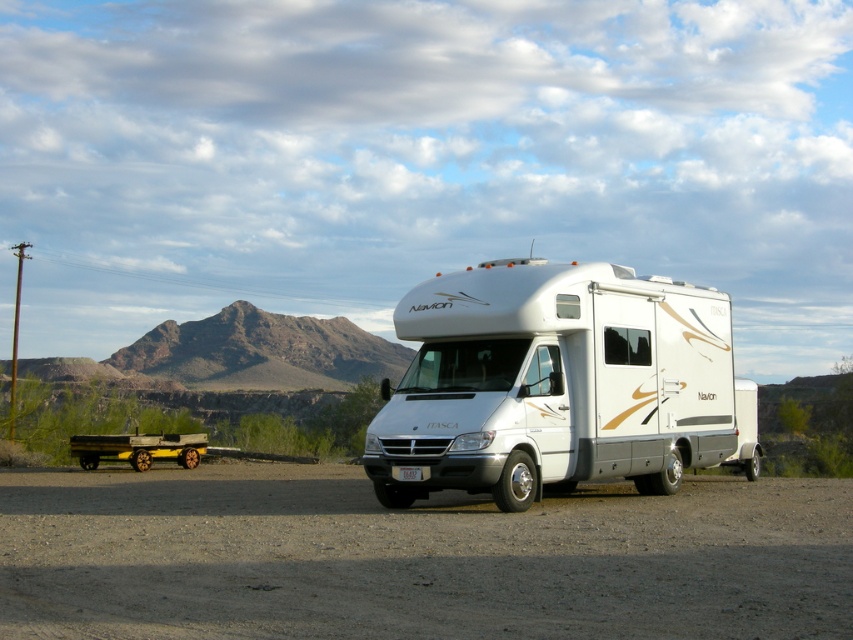
Question: Does white glossy recreational vehicle at center come behind wooden planks at lower left?

Choices:
 (A) yes
 (B) no

Answer: (B)

Question: Which point appears farthest from the camera in this image?

Choices:
 (A) (383, 472)
 (B) (114, 518)
 (C) (183, 445)

Answer: (C)

Question: Which of these objects is positioned farthest from the white glossy recreational vehicle at center?

Choices:
 (A) gray gravel dirt track at center
 (B) wooden planks at lower left

Answer: (B)

Question: Can you confirm if gray gravel dirt track at center is bigger than white glossy recreational vehicle at center?

Choices:
 (A) yes
 (B) no

Answer: (A)

Question: Is gray gravel dirt track at center positioned behind white glossy recreational vehicle at center?

Choices:
 (A) no
 (B) yes

Answer: (A)

Question: Which of the following is the farthest from the observer?

Choices:
 (A) white glossy recreational vehicle at center
 (B) gray gravel dirt track at center
 (C) wooden planks at lower left

Answer: (C)